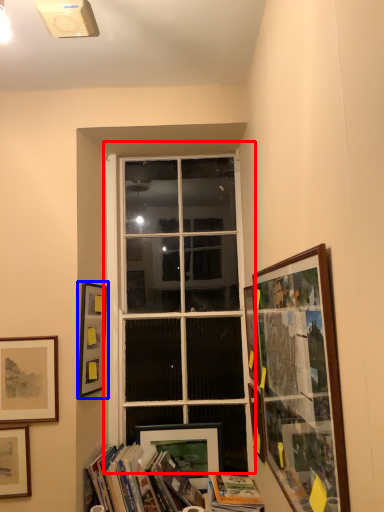
Question: Which object is closer to the camera taking this photo, window (highlighted by a red box) or picture frame (highlighted by a blue box)?

Choices:
 (A) window
 (B) picture frame

Answer: (B)